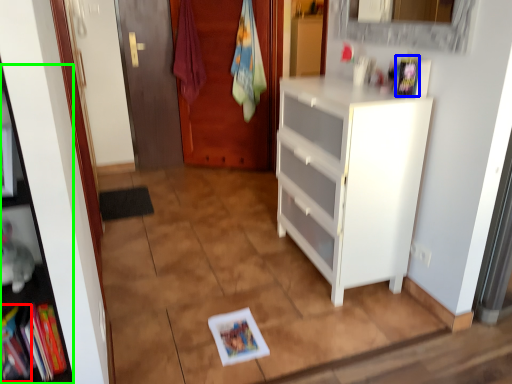
Question: Based on their relative distances, which object is farther from book (highlighted by a red box)? Choose from book (highlighted by a blue box) and cabinet (highlighted by a green box).

Choices:
 (A) book
 (B) cabinet

Answer: (A)